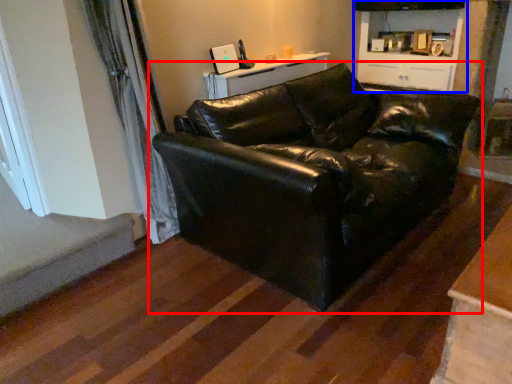
Question: Which of the following is the closest to the observer, studio couch (highlighted by a red box) or cabinetry (highlighted by a blue box)?

Choices:
 (A) studio couch
 (B) cabinetry

Answer: (A)